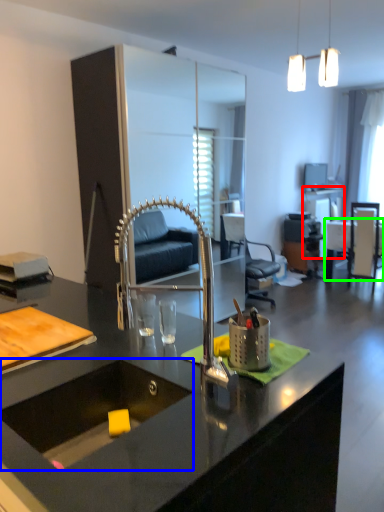
Question: Considering the real-world distances, which object is closest to table (highlighted by a red box)? sink (highlighted by a blue box) or table (highlighted by a green box).

Choices:
 (A) sink
 (B) table

Answer: (B)